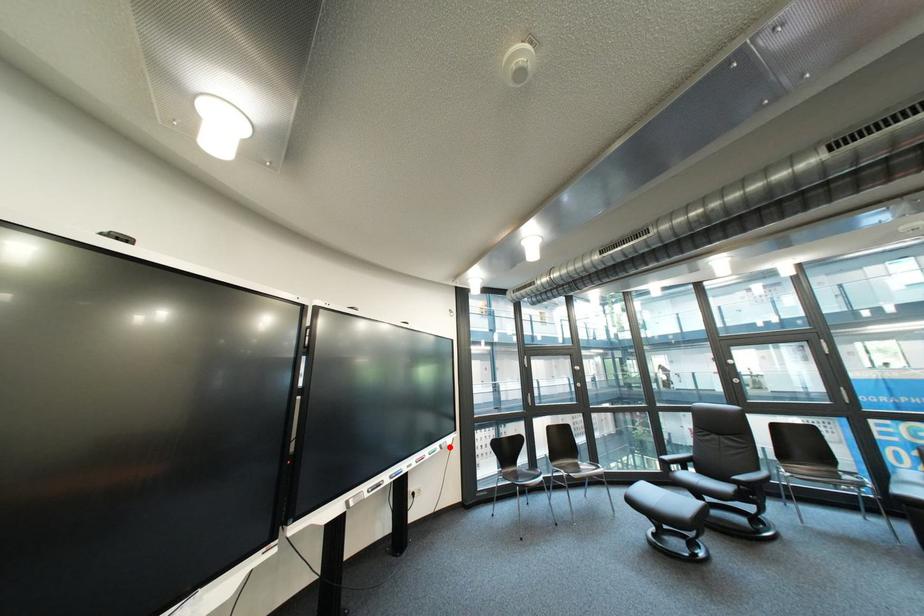
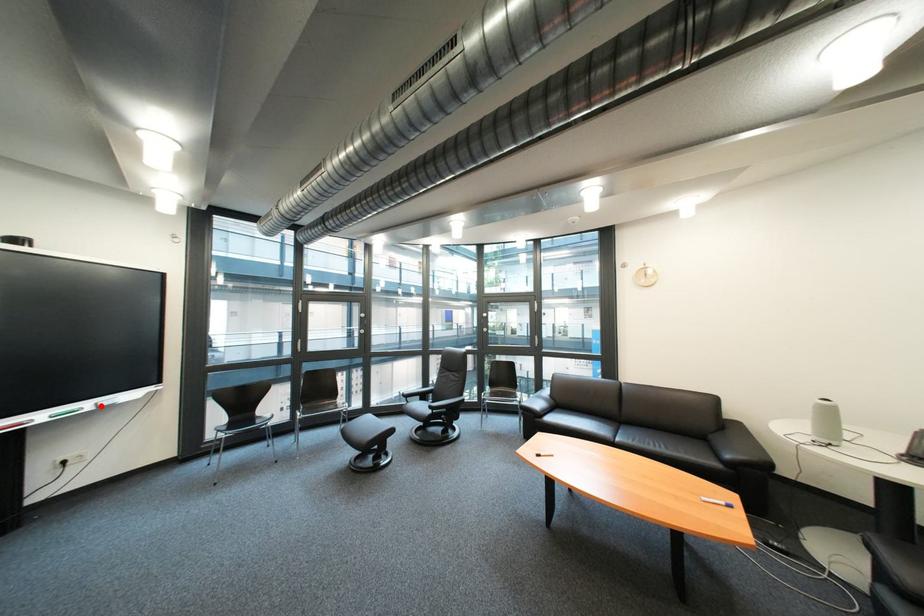
I am providing you with two images of the same scene from different viewpoints. A red point is marked on the first image and another point is marked on the second image. Do the highlighted points in image1 and image2 indicate the same real-world spot?

Yes